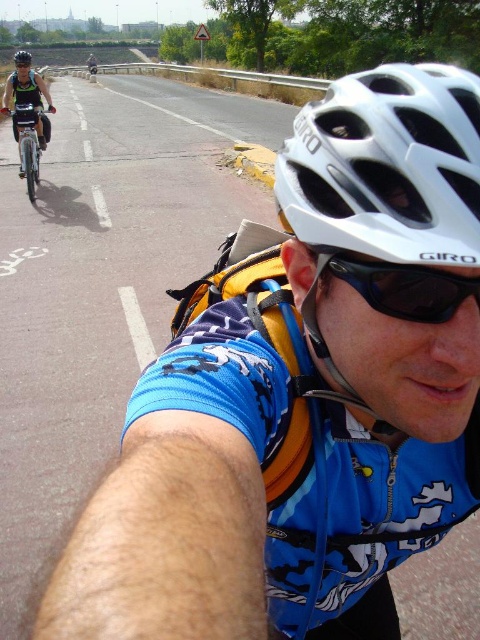
Between white matte helmet at center and black plastic sunglasses at center, which one appears on the left side from the viewer's perspective?

white matte helmet at center

The image size is (480, 640). I want to click on white matte helmet at center, so click(x=385, y=170).

Does matte black helmet at upper center have a greater width compared to matte black bicycle at upper left?

Incorrect, matte black helmet at upper center's width does not surpass matte black bicycle at upper left's.

What do you see at coordinates (25, 88) in the screenshot? This screenshot has height=640, width=480. I see `matte black helmet at upper center` at bounding box center [25, 88].

Where is `matte black helmet at upper center`? The height and width of the screenshot is (640, 480). matte black helmet at upper center is located at coordinates (25, 88).

From the picture: Which is above, black plastic sunglasses at center or matte black bicycle at upper left?

matte black bicycle at upper left

Can you confirm if black plastic sunglasses at center is shorter than matte black bicycle at upper left?

Yes.

What do you see at coordinates (406, 288) in the screenshot? This screenshot has width=480, height=640. I see `black plastic sunglasses at center` at bounding box center [406, 288].

At what (x,y) coordinates should I click in order to perform the action: click on black plastic sunglasses at center. Please return your answer as a coordinate pair (x, y). Looking at the image, I should click on coord(406,288).